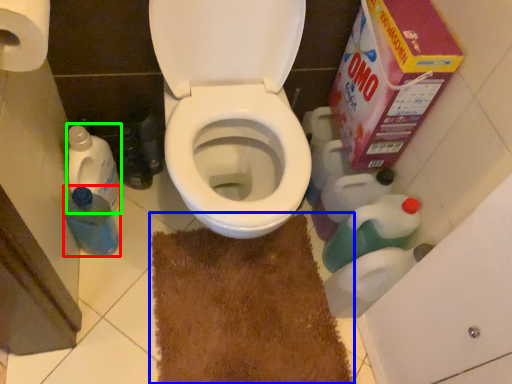
Question: Which object is positioned closest to bottle (highlighted by a red box)? Select from doormat (highlighted by a blue box) and cleaning product (highlighted by a green box).

Choices:
 (A) doormat
 (B) cleaning product

Answer: (B)